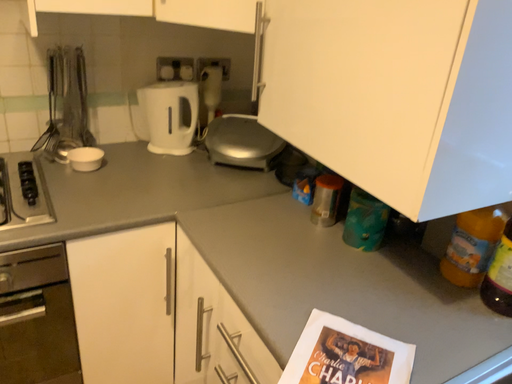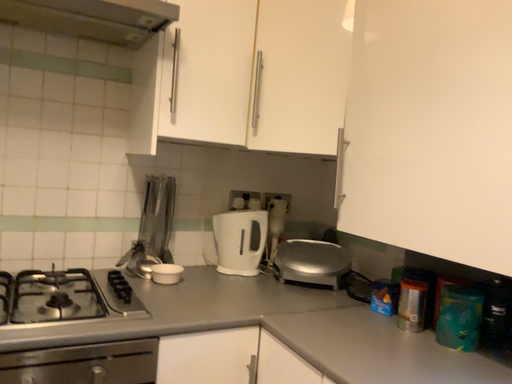
Question: Which way did the camera rotate in the video?

Choices:
 (A) rotated downward
 (B) rotated upward

Answer: (B)